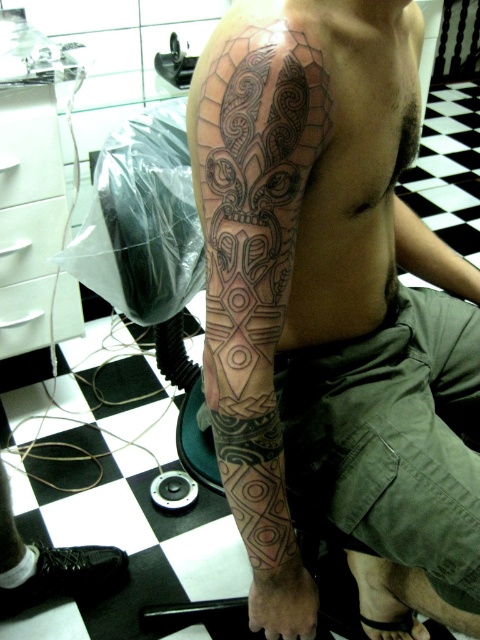
You are a tattoo artist assessing the placement of two tattoos on a client. The client has a black ink tattoo at upper arm and a black ink tattoo at upper center. Based on the image, which tattoo is wider?

The black ink tattoo at upper arm is wider than the black ink tattoo at upper center according to the description provided.

You are standing in a tattoo parlor and want to measure the distance between your eyes and the point where the tattoo starts on the left arm. The point is labeled as point (217, 314). Can you estimate how far apart they are?

The distance between your eyes and the point (217, 314) is 26.44 inches.

You are a tattoo artist assessing a client who wants to add a new tattoo. The client has two existing tattoos on their left arm. The first is the black ink tattoo at upper arm, and the second is the black ink tattoo at lower right. Which tattoo is bigger?

The black ink tattoo at upper arm is larger in size compared to the black ink tattoo at lower right.